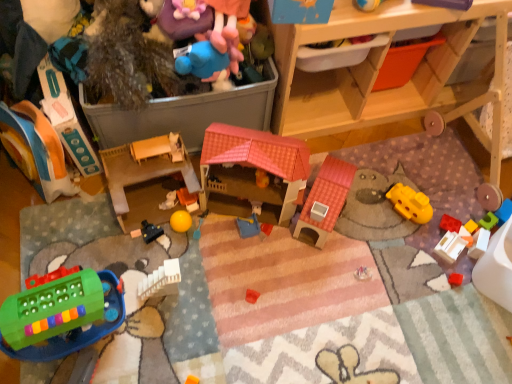
I want to click on vacant space in between yellow rubber ball at center, the 6th toy from the left, and white plastic toy at lower right, which is counted as the tenth toy, starting from the left, so click(x=331, y=243).